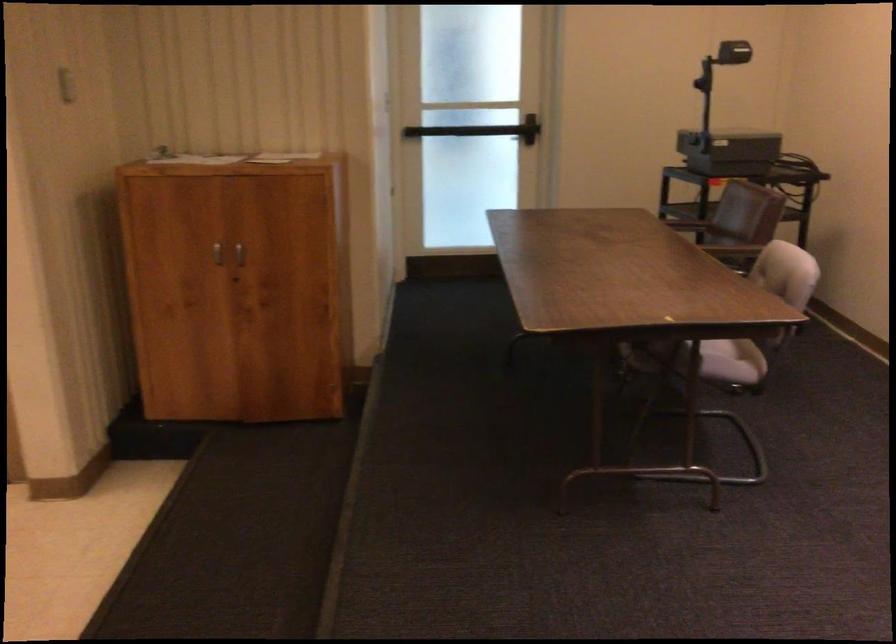
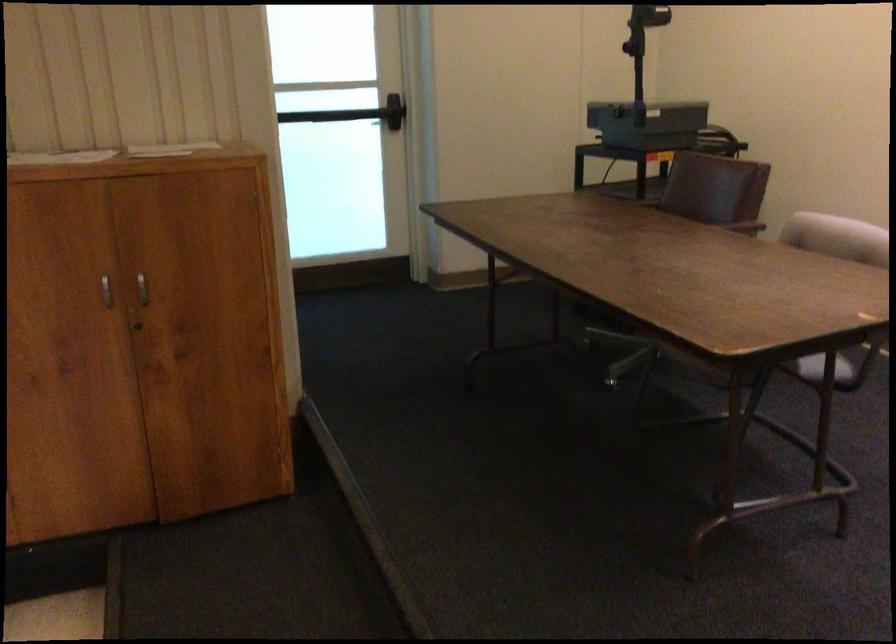
The point at (754, 247) is marked in the first image. Where is the corresponding point in the second image?

(739, 223)